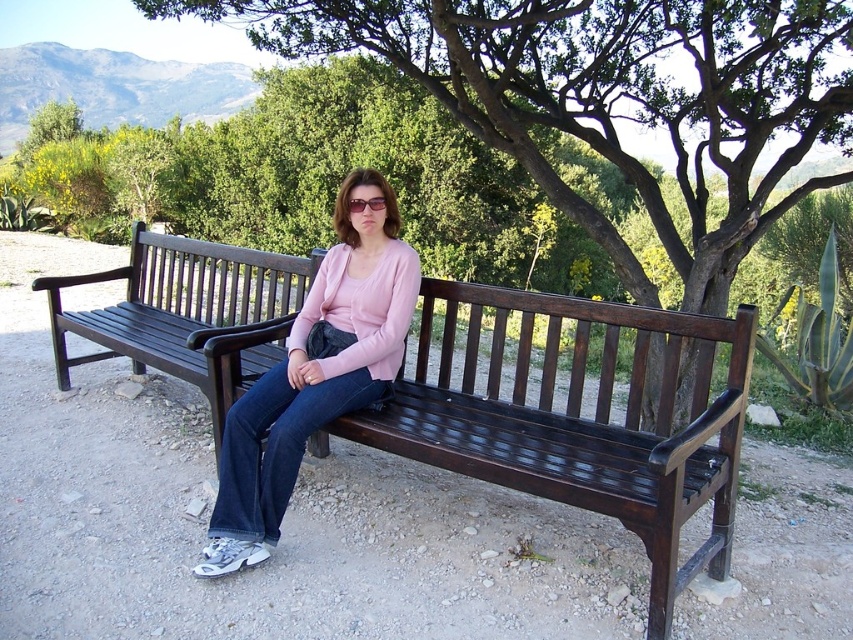
Question: Which point is farther to the camera?

Choices:
 (A) dark brown wood bench at center
 (B) matte black sunglasses at center
 (C) matte pink sweater at center

Answer: (B)

Question: Is green leafy tree at center wider than dark brown wood bench at center?

Choices:
 (A) yes
 (B) no

Answer: (B)

Question: Does matte pink sweater at center have a greater width compared to matte black sunglasses at center?

Choices:
 (A) yes
 (B) no

Answer: (A)

Question: Which of the following is the closest to the observer?

Choices:
 (A) green leafy tree at center
 (B) matte black sunglasses at center
 (C) matte pink sweater at center
 (D) dark brown wood bench at center

Answer: (C)

Question: Which object appears farthest from the camera in this image?

Choices:
 (A) matte pink sweater at center
 (B) dark brown wood bench at center
 (C) matte black sunglasses at center
 (D) green leafy tree at center

Answer: (D)

Question: Is dark brown wood bench at center thinner than matte pink sweater at center?

Choices:
 (A) no
 (B) yes

Answer: (A)